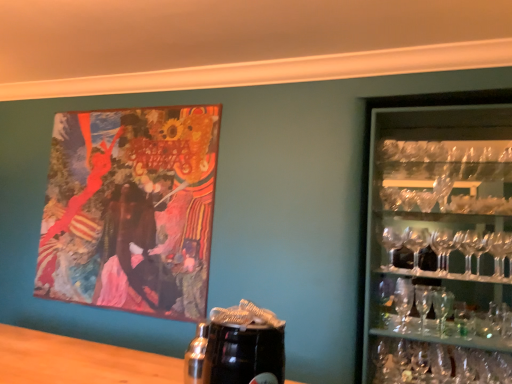
Question: Does oil painting at upper left have a smaller size compared to clear glass martini glass at right?

Choices:
 (A) no
 (B) yes

Answer: (A)

Question: From a real-world perspective, is oil painting at upper left on top of clear glass martini glass at right?

Choices:
 (A) yes
 (B) no

Answer: (A)

Question: Is oil painting at upper left turned away from clear glass martini glass at right?

Choices:
 (A) yes
 (B) no

Answer: (B)

Question: Is oil painting at upper left outside of clear glass martini glass at right?

Choices:
 (A) no
 (B) yes

Answer: (B)

Question: Is oil painting at upper left shorter than clear glass martini glass at right?

Choices:
 (A) yes
 (B) no

Answer: (B)

Question: From the image's perspective, is transparent glassware at right positioned above or below clear glass martini glass at right?

Choices:
 (A) below
 (B) above

Answer: (B)

Question: From their relative heights in the image, would you say transparent glassware at right is taller or shorter than clear glass martini glass at right?

Choices:
 (A) tall
 (B) short

Answer: (A)

Question: Is transparent glassware at right inside or outside of clear glass martini glass at right?

Choices:
 (A) outside
 (B) inside

Answer: (A)

Question: Visually, is transparent glassware at right positioned to the left or to the right of clear glass martini glass at right?

Choices:
 (A) left
 (B) right

Answer: (B)

Question: Considering the positions of point (437, 324) and point (147, 228), is point (437, 324) closer or farther from the camera than point (147, 228)?

Choices:
 (A) farther
 (B) closer

Answer: (B)

Question: From the image's perspective, is clear glass martini glass at right above or below oil painting at upper left?

Choices:
 (A) below
 (B) above

Answer: (A)

Question: Choose the correct answer: Is clear glass martini glass at right inside oil painting at upper left or outside it?

Choices:
 (A) outside
 (B) inside

Answer: (A)

Question: Considering the relative positions of clear glass martini glass at right and oil painting at upper left in the image provided, is clear glass martini glass at right to the left or to the right of oil painting at upper left?

Choices:
 (A) right
 (B) left

Answer: (A)

Question: Visually, is oil painting at upper left positioned to the left or to the right of clear glass martini glass at right?

Choices:
 (A) left
 (B) right

Answer: (A)

Question: Is oil painting at upper left taller or shorter than clear glass martini glass at right?

Choices:
 (A) tall
 (B) short

Answer: (A)